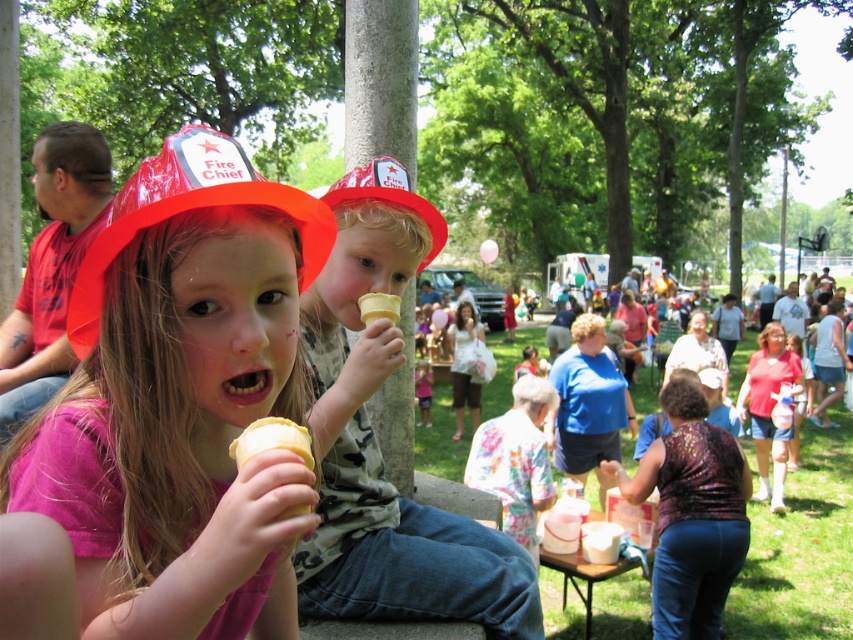
Question: Can you confirm if matte plastic fire chief hat at upper center is smaller than yellow waffle cone ice cream at center?

Choices:
 (A) no
 (B) yes

Answer: (A)

Question: Is matte plastic ice cream cone at center below matte plastic fire chief hat at upper left?

Choices:
 (A) no
 (B) yes

Answer: (B)

Question: Which of these objects is positioned farthest from the yellow waffle cone at center?

Choices:
 (A) yellow waffle cone ice cream at center
 (B) matte plastic ice cream cone at center
 (C) matte plastic fire chief hat at upper center

Answer: (A)

Question: Which object is farther from the camera taking this photo?

Choices:
 (A) matte plastic fire chief hat at upper left
 (B) matte plastic fire chief hat at upper center
 (C) matte plastic ice cream cone at center

Answer: (B)

Question: Which point is farther to the camera?

Choices:
 (A) (241, 467)
 (B) (332, 230)

Answer: (B)

Question: Can you confirm if matte plastic fire chief hat at upper left is bigger than yellow waffle cone at center?

Choices:
 (A) no
 (B) yes

Answer: (B)